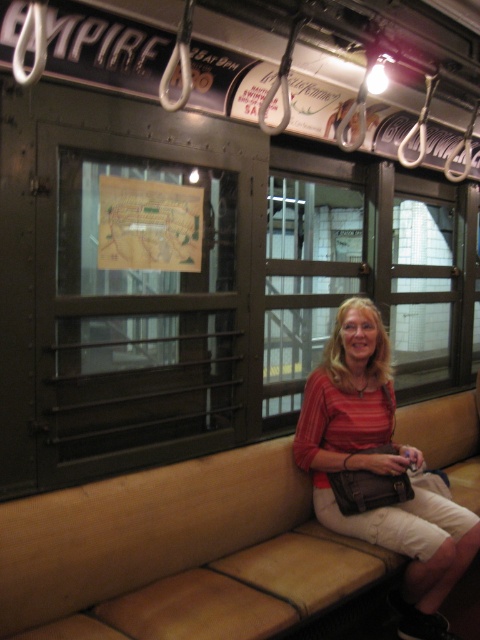
Question: Which point is farther from the camera taking this photo?

Choices:
 (A) (409, 492)
 (B) (277, 572)

Answer: (A)

Question: Among these points, which one is nearest to the camera?

Choices:
 (A) click(348, 314)
 (B) click(112, 602)

Answer: (B)

Question: Is beige leather couch at center smaller than matte red blouse at center?

Choices:
 (A) no
 (B) yes

Answer: (A)

Question: Can you confirm if beige leather couch at center is thinner than matte red blouse at center?

Choices:
 (A) no
 (B) yes

Answer: (A)

Question: Is beige leather couch at center positioned at the back of matte red blouse at center?

Choices:
 (A) yes
 (B) no

Answer: (B)

Question: Which of the following is the closest to the observer?

Choices:
 (A) beige leather couch at center
 (B) matte red blouse at center

Answer: (A)